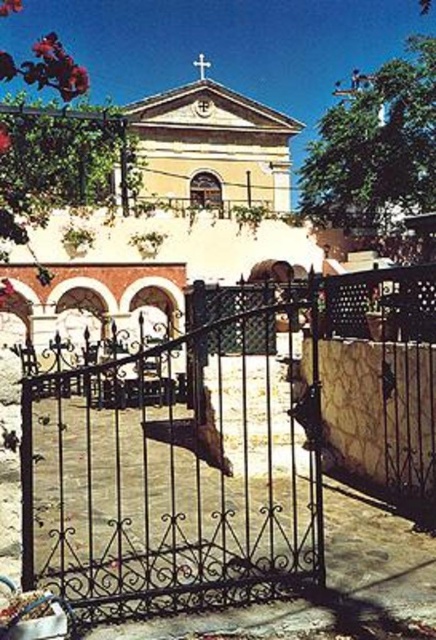
Does wrought iron gate at center lie in front of white wooden door at center?

That is True.

Locate an element on the screen. The width and height of the screenshot is (436, 640). wrought iron gate at center is located at coordinates (224, 445).

Where is `wrought iron gate at center`? wrought iron gate at center is located at coordinates (224, 445).